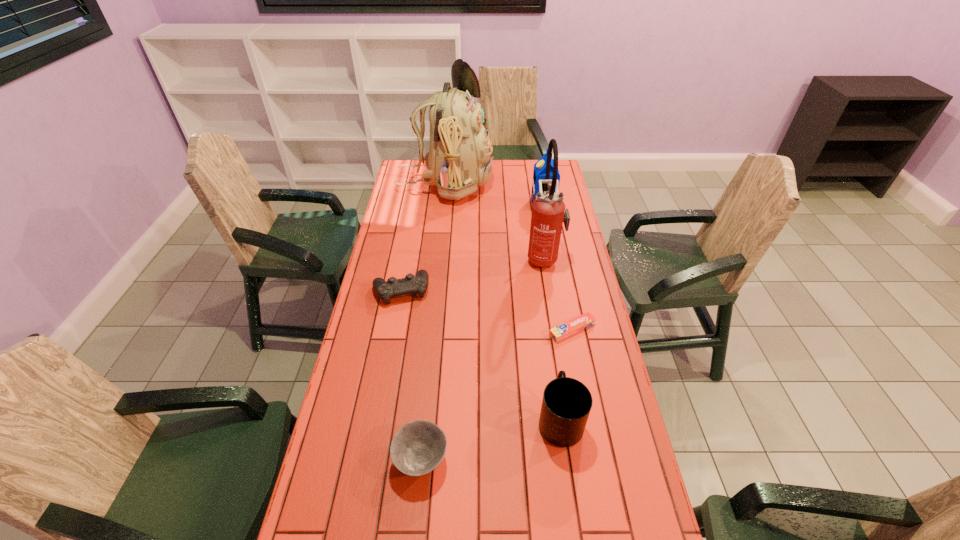
The height and width of the screenshot is (540, 960). I want to click on free location at the left edge of the desktop, so click(x=378, y=390).

The width and height of the screenshot is (960, 540). I want to click on free space at the right edge of the desktop, so click(586, 474).

Find the location of a particular element. vacant area that lies between the third tallest object and the bowl is located at coordinates (482, 332).

I want to click on free spot between the bowl and the third tallest object, so click(482, 332).

Image resolution: width=960 pixels, height=540 pixels. Identify the location of unoccupied area between the toothpaste and the backpack. pos(509,256).

Locate an element on the screen. The width and height of the screenshot is (960, 540). blank region between the bowl and the carton is located at coordinates (482, 332).

Identify the location of free area in between the toothpaste and the backpack. The image size is (960, 540). (509, 256).

Identify the location of free area in between the fifth nearest object and the third nearest object. Image resolution: width=960 pixels, height=540 pixels. (558, 294).

You are a GUI agent. You are given a task and a screenshot of the screen. Output one action in this format:
    pyautogui.click(x=<x>, y=<y>)
    Task: Click on the free spot between the control and the carton
    The width and height of the screenshot is (960, 540).
    Given the screenshot: What is the action you would take?
    pyautogui.click(x=472, y=247)

Locate an element on the screen. vacant area between the bowl and the backpack is located at coordinates (433, 321).